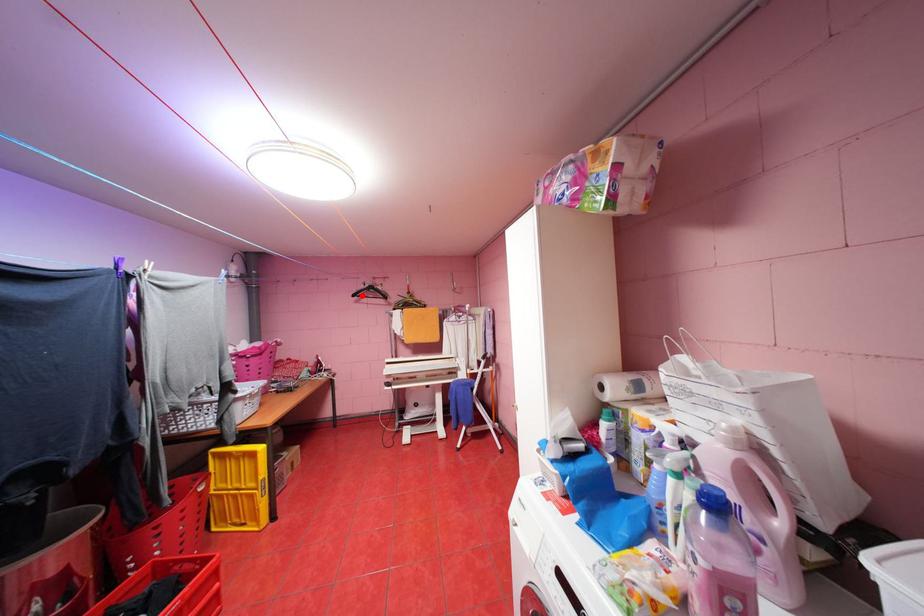
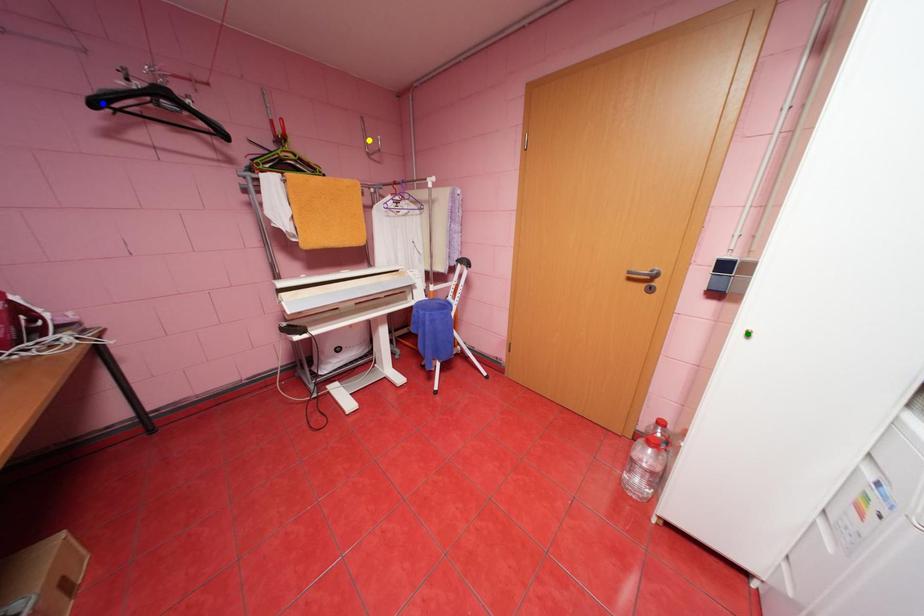
Question: I am providing you with two images of the same scene from different viewpoints. A red point is marked on the first image. You are given multiple points on the second image. Which spot in image 2 lines up with the point in image 1?

Choices:
 (A) green point
 (B) yellow point
 (C) blue point

Answer: (C)